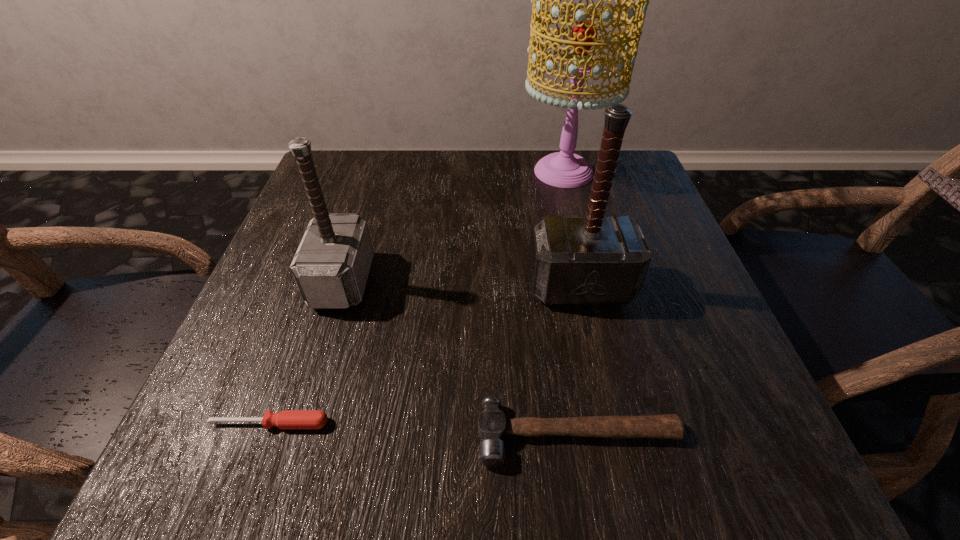
In order to click on free space between the second shortest hammer and the tallest object in this screenshot , I will do `click(453, 226)`.

Where is `free space that is in between the third tallest object and the second tallest object`? The width and height of the screenshot is (960, 540). free space that is in between the third tallest object and the second tallest object is located at coordinates (461, 284).

The image size is (960, 540). I want to click on free spot between the screwdriver and the leftmost hammer, so click(306, 352).

The height and width of the screenshot is (540, 960). In order to click on vacant space in between the shortest object and the leftmost hammer in this screenshot , I will do `click(306, 352)`.

Where is `unoccupied area between the leftmost hammer and the screwdriver`? The width and height of the screenshot is (960, 540). unoccupied area between the leftmost hammer and the screwdriver is located at coordinates (306, 352).

This screenshot has height=540, width=960. Identify the location of free space between the second shortest hammer and the screwdriver. (306, 352).

At what (x,y) coordinates should I click in order to perform the action: click on empty space that is in between the second shortest hammer and the second tallest object. Please return your answer as a coordinate pair (x, y). The image size is (960, 540). Looking at the image, I should click on (461, 284).

I want to click on free point between the leftmost hammer and the tallest hammer, so click(x=461, y=284).

The width and height of the screenshot is (960, 540). I want to click on the closest object to the screwdriver, so pos(331,266).

Locate which object is the closest to the farthest object. Please provide its 2D coordinates. Your answer should be formatted as a tuple, i.e. [(x, y)], where the tuple contains the x and y coordinates of a point satisfying the conditions above.

[(595, 259)]